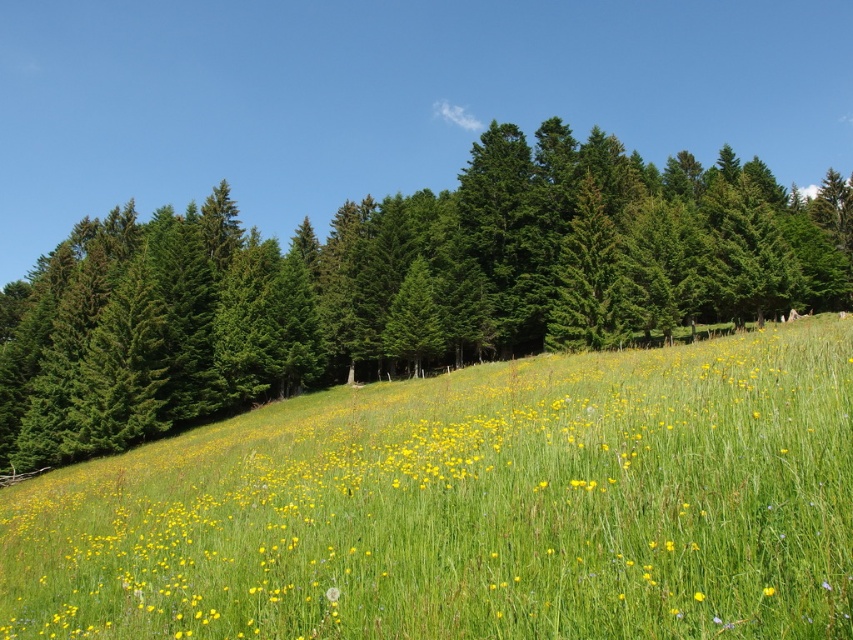
Question: Does yellow grass at center appear over green textured pine forest at upper center?

Choices:
 (A) no
 (B) yes

Answer: (A)

Question: Which point appears closest to the camera in this image?

Choices:
 (A) (532, 570)
 (B) (595, 189)
 (C) (766, 588)

Answer: (C)

Question: Which object is positioned closest to the green textured pine forest at upper center?

Choices:
 (A) yellow matte flower at center
 (B) yellow grass at center

Answer: (B)

Question: Is green textured pine forest at upper center wider than yellow matte flower at center?

Choices:
 (A) yes
 (B) no

Answer: (A)

Question: Which of the following is the closest to the observer?

Choices:
 (A) yellow matte flower at center
 (B) green textured pine forest at upper center
 (C) yellow grass at center

Answer: (C)

Question: Is yellow grass at center to the right of yellow matte flower at center from the viewer's perspective?

Choices:
 (A) yes
 (B) no

Answer: (A)